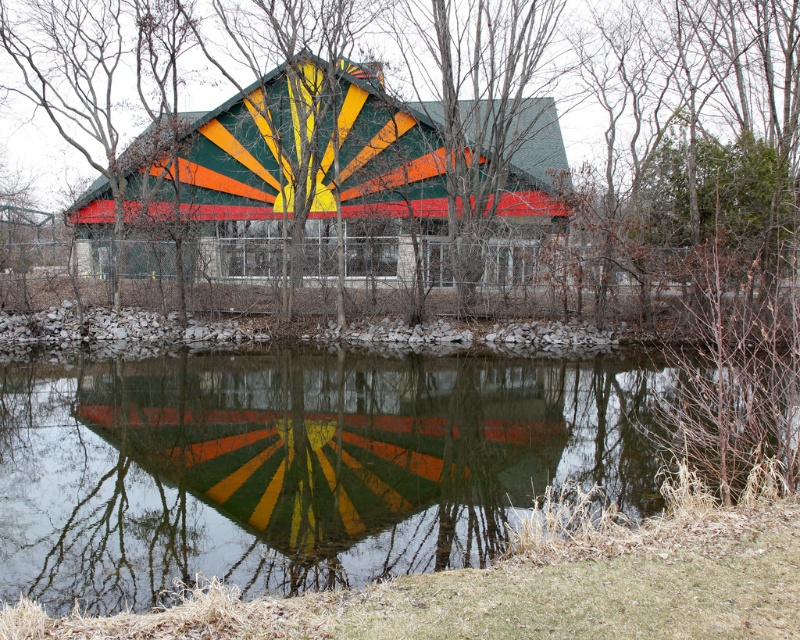
You are standing on the edge of the water and want to take a photo of the painted wooden barn at center. Since the transparent water at center is between you and the barn, will the barn be visible in your photo?

The transparent water at center is in front of painted wooden barn at center, so the barn will be visible through the water in your photo.

Looking at this image, you are standing in front of the building and want to see the reflection of the painted wooden barn at center in the transparent water at center. Is the reflection visible?

The transparent water at center is below painted wooden barn at center, so the reflection of the painted wooden barn at center would be visible in the transparent water at center since the water is still and acts as a mirror.

You are standing on the edge of the transparent water at center and want to walk to the multicolored painted roof at center. Is the distance you need to cover wider than the roof itself?

The transparent water at center has a width larger than the multicolored painted roof at center, so the distance you need to cover is wider than the roof itself.